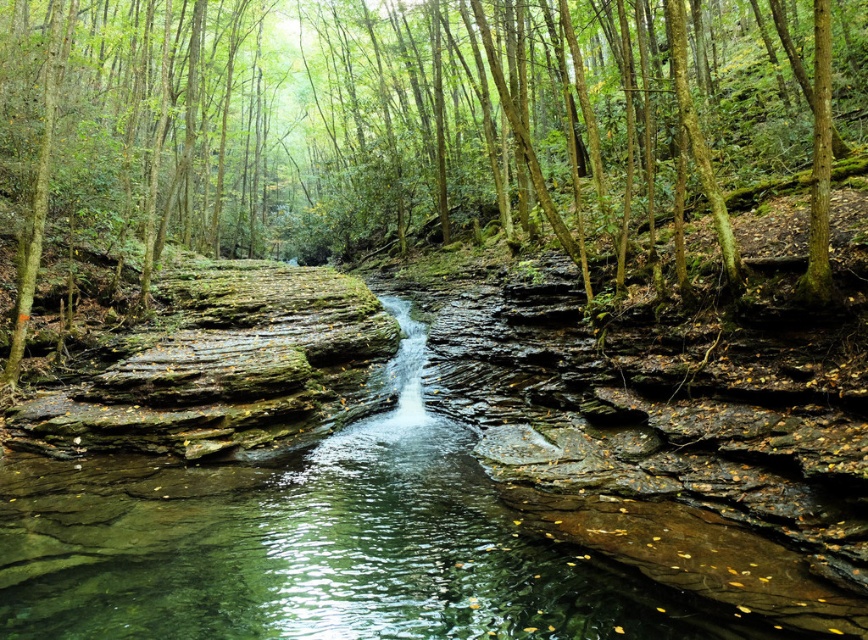
You are standing at the edge of the forest and see the point marked at coordinates point (x=380, y=122). What is the surface type at that location?

The surface at point (x=380, y=122) is green mossy rock at center.

You are standing at the edge of the forest clearing and see the green mossy rock at center. If you move 0.1 units to the right along the x axis, will you be closer to the rock?

Moving 0.1 units to the right along the x axis would take you away from the green mossy rock at center located at point 0.192 on the x axis. Since you are moving in the positive x direction, you are moving away from the rock which is at a lower x coordinate. Therefore, you will be farther from the rock.

You are a hiker standing at the edge of the forest. You see the green mossy rock at center and the clear stone waterfall at center. How far apart are these two landmarks?

The green mossy rock at center is 24.69 meters away from the clear stone waterfall at center.